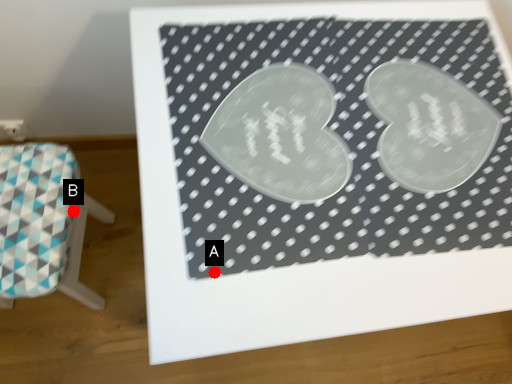
Question: Two points are circled on the image, labeled by A and B beside each circle. Which of the following is the closest to the observer?

Choices:
 (A) A is closer
 (B) B is closer

Answer: (A)